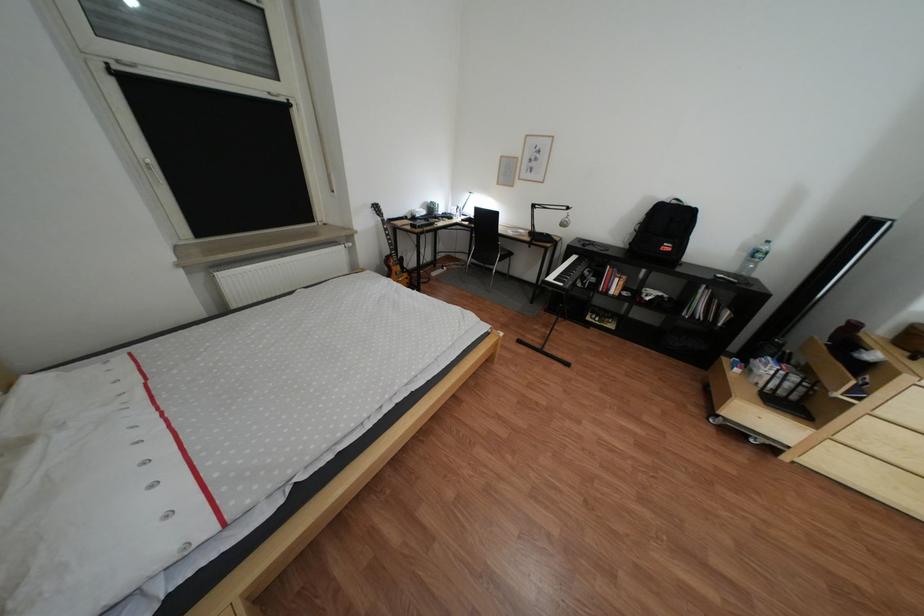
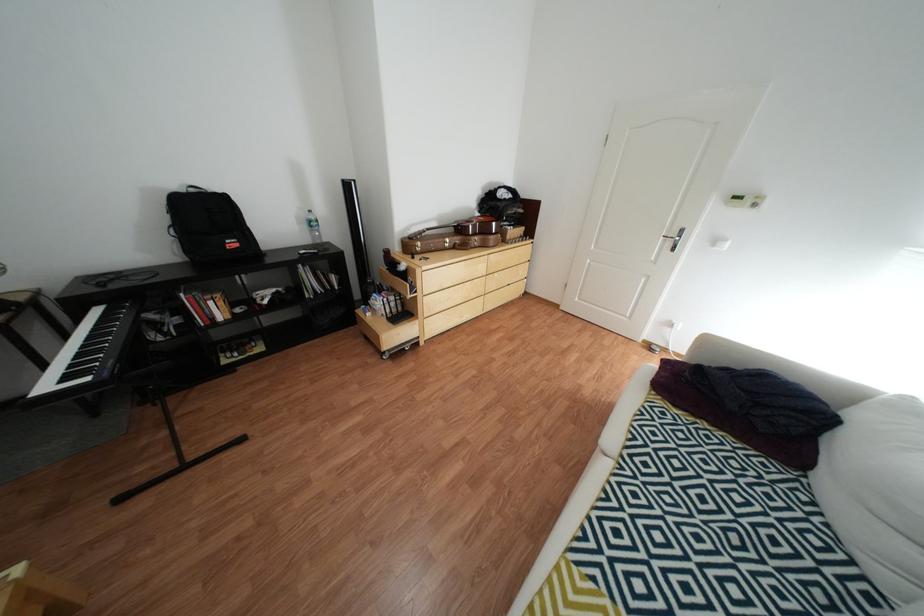
Based on the continuous images, in which direction is the camera rotating?

The camera's rotation is toward right-down.